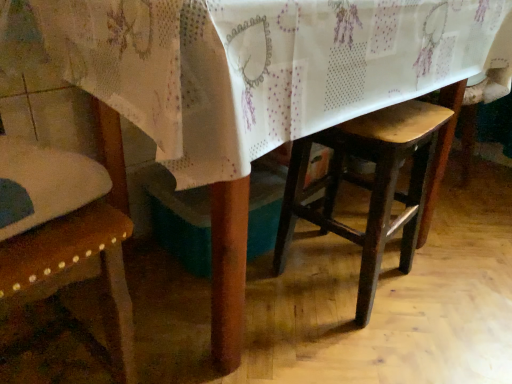
Question: Is wooden chair at left closer to the viewer compared to wooden stool at center?

Choices:
 (A) yes
 (B) no

Answer: (A)

Question: Could wooden stool at center be considered to be inside wooden chair at left?

Choices:
 (A) yes
 (B) no

Answer: (B)

Question: From the image's perspective, does wooden chair at left appear higher than wooden stool at center?

Choices:
 (A) yes
 (B) no

Answer: (B)

Question: Considering the relative sizes of wooden chair at left and wooden stool at center in the image provided, is wooden chair at left wider than wooden stool at center?

Choices:
 (A) no
 (B) yes

Answer: (B)

Question: Considering the relative sizes of wooden chair at left and wooden stool at center in the image provided, is wooden chair at left thinner than wooden stool at center?

Choices:
 (A) yes
 (B) no

Answer: (B)

Question: Can you confirm if wooden chair at left is smaller than wooden stool at center?

Choices:
 (A) yes
 (B) no

Answer: (B)

Question: Considering the relative sizes of wooden stool at center and wooden chair at left in the image provided, is wooden stool at center taller than wooden chair at left?

Choices:
 (A) no
 (B) yes

Answer: (A)

Question: From a real-world perspective, is wooden stool at center below wooden chair at left?

Choices:
 (A) no
 (B) yes

Answer: (B)

Question: Would you say wooden stool at center contains wooden chair at left?

Choices:
 (A) yes
 (B) no

Answer: (B)

Question: Does wooden stool at center have a greater width compared to wooden chair at left?

Choices:
 (A) yes
 (B) no

Answer: (B)

Question: Considering the relative positions of wooden stool at center and wooden chair at left in the image provided, is wooden stool at center to the left of wooden chair at left from the viewer's perspective?

Choices:
 (A) yes
 (B) no

Answer: (B)

Question: Is wooden stool at center closer to camera compared to wooden chair at left?

Choices:
 (A) yes
 (B) no

Answer: (B)

Question: Is point (378, 211) closer or farther from the camera than point (108, 150)?

Choices:
 (A) closer
 (B) farther

Answer: (A)